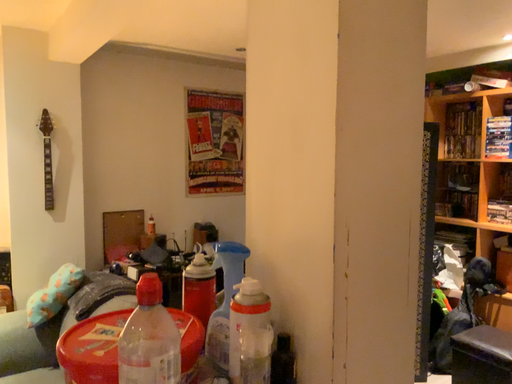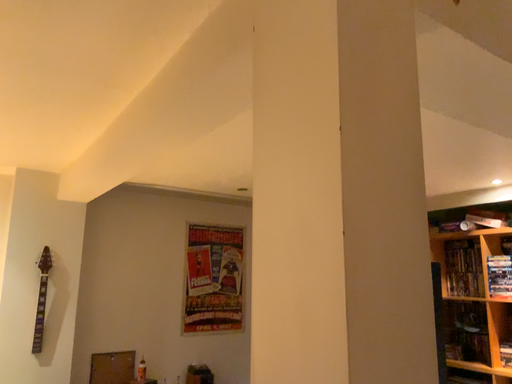
Question: Which way did the camera rotate in the video?

Choices:
 (A) rotated upward
 (B) rotated downward

Answer: (A)